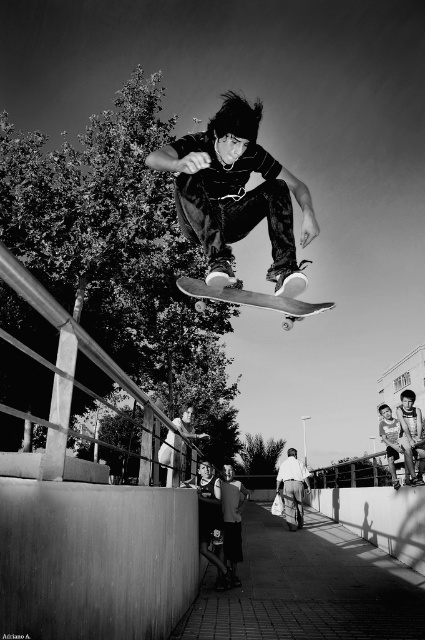
Between point (195, 193) and point (297, 493), which one is positioned behind?

The point (297, 493) is more distant.

Consider the image. Does matte black skateboard at center appear on the left side of denim pants at lower center?

Correct, you'll find matte black skateboard at center to the left of denim pants at lower center.

Does point (285, 257) lie behind point (302, 518)?

No, it is not.

Where is `matte black skateboard at center`? The image size is (425, 640). matte black skateboard at center is located at coordinates (235, 195).

Does point (257, 196) come behind point (187, 284)?

No.

Describe the element at coordinates (235, 195) in the screenshot. I see `matte black skateboard at center` at that location.

Which is behind, point (201, 157) or point (204, 291)?

Point (204, 291)

Find the location of a particular element. The height and width of the screenshot is (640, 425). matte black skateboard at center is located at coordinates (235, 195).

Which is behind, point (237, 301) or point (289, 451)?

Point (289, 451)

The image size is (425, 640). Describe the element at coordinates (249, 300) in the screenshot. I see `wooden skateboard at center` at that location.

Which is in front, point (320, 305) or point (283, 502)?

Point (320, 305) is in front.

Find the location of a particular element. The height and width of the screenshot is (640, 425). wooden skateboard at center is located at coordinates (249, 300).